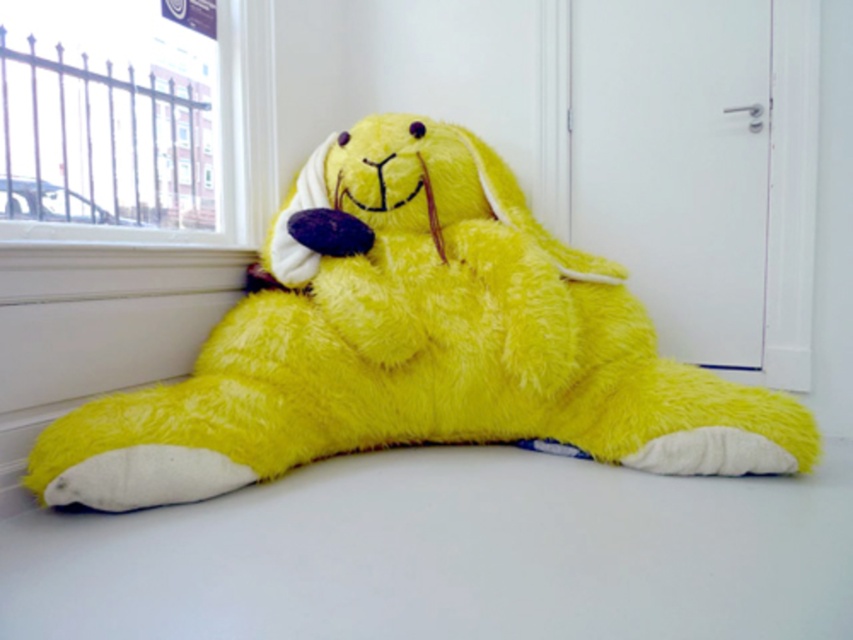
You are a delivery robot with a 1.5 meter wide package. You need to place it between the fluffy yellow plush at center and the window with metal railing on the left. Can you fit the package there?

The distance between the fluffy yellow plush at center and the window with metal railing on the left is 1.49 meters, which is narrower than the 1.5 meter wide package. Therefore, the package cannot fit in that space.

You are trying to determine if the fluffy yellow plush at center can be placed on a shelf that is the same height as the metallic fence at upper left. Based on the scene, will it fit?

The fluffy yellow plush at center has a greater height compared to the metallic fence at upper left, so it will not fit on the shelf which is the same height as the metallic fence at upper left.